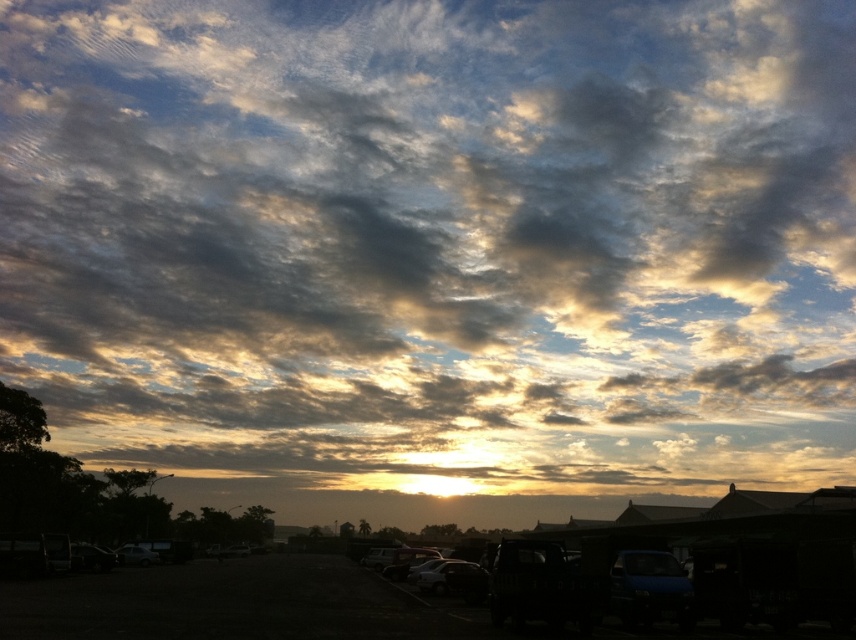
You are standing in the parking lot and see two points marked in the image. The first point is at coordinate point [432,548] and the second is at point [123,545]. Which point is closer to you?

Point [432,548] is in front of point [123,545], so the first point is closer to you.